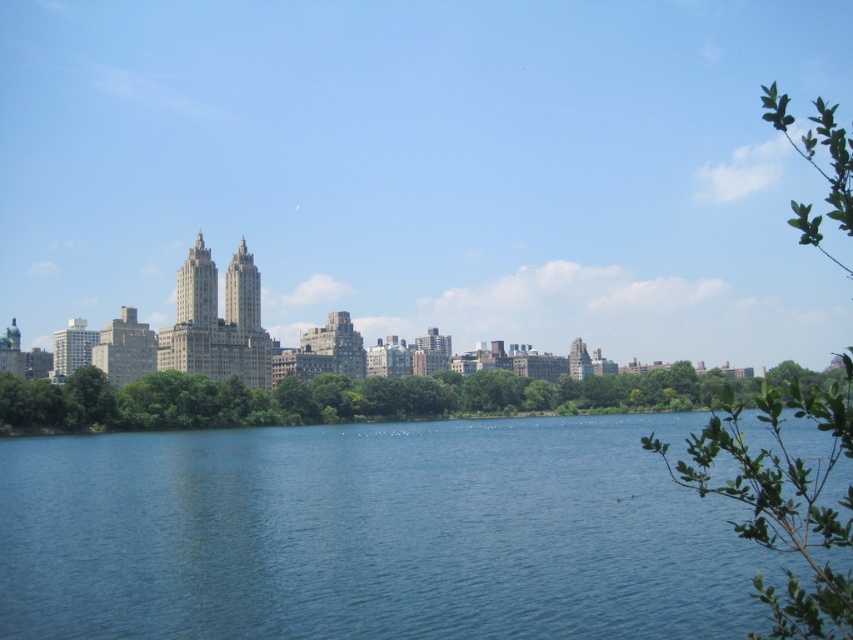
Question: Is the position of blue water at center less distant than that of green leafy trees at center?

Choices:
 (A) no
 (B) yes

Answer: (B)

Question: Which point is farther to the camera?

Choices:
 (A) 798,609
 (B) 631,476

Answer: (B)

Question: From the image, what is the correct spatial relationship of green leafy trees at center in relation to green leafy branch at upper right?

Choices:
 (A) below
 (B) above

Answer: (A)

Question: Which point is closer to the camera?

Choices:
 (A) blue water at center
 (B) green leafy branch at upper right
 (C) green leafy trees at center

Answer: (B)

Question: Is blue water at center further to the viewer compared to green leafy branch at upper right?

Choices:
 (A) no
 (B) yes

Answer: (B)

Question: Which point is farther to the camera?

Choices:
 (A) (354, 596)
 (B) (561, 410)
 (C) (779, 596)

Answer: (B)